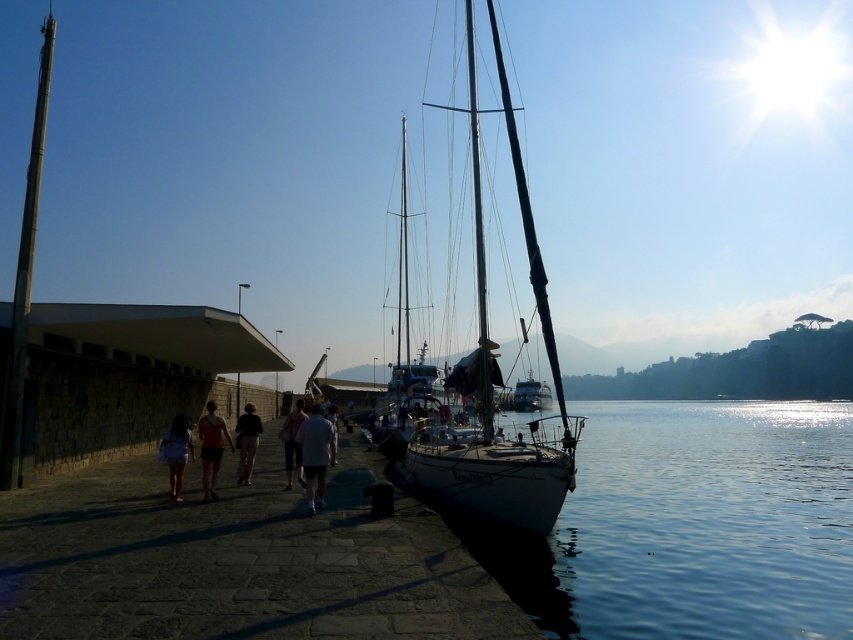
You are standing on the paved walkway and want to reach the white matte sailboat at center. According to the coordinates provided, in which direction should you walk from your current position on the walkway?

The white matte sailboat at center is located at coordinates point (492,381). Based on the coordinates, you should walk towards the center of the image to reach the white matte sailboat at center.

You are standing at the camera position and want to walk to the point that is closer to you. Which point should you head towards, point at (x=206, y=448) or point at (x=283, y=440)?

You should head towards point at (x=206, y=448) because it is closer to the camera than point at (x=283, y=440).

You are a photographer trying to capture a candid shot of the people on the walkway. You notice the white cotton shirt at lower left and the black fabric jacket at center. Which clothing item would appear smaller in your photo due to perspective?

The white cotton shirt at lower left would appear smaller in the photo because it is closer to the camera than the black fabric jacket at center, and objects closer to the camera appear smaller when viewed from the same distance.